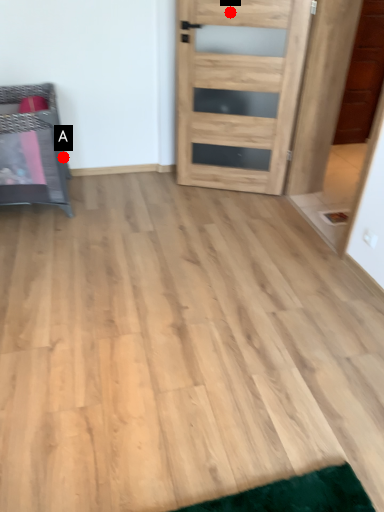
Question: Two points are circled on the image, labeled by A and B beside each circle. Which point appears farthest from the camera in this image?

Choices:
 (A) A is further
 (B) B is further

Answer: (A)